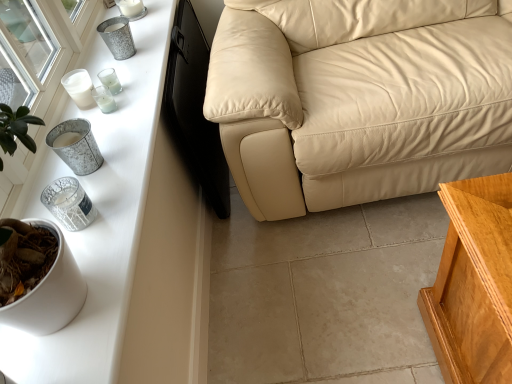
Identify the location of vacant area that lies to the right of metallic glass candle at upper left, the fourth candle holder when ordered from top to bottom. (141, 105).